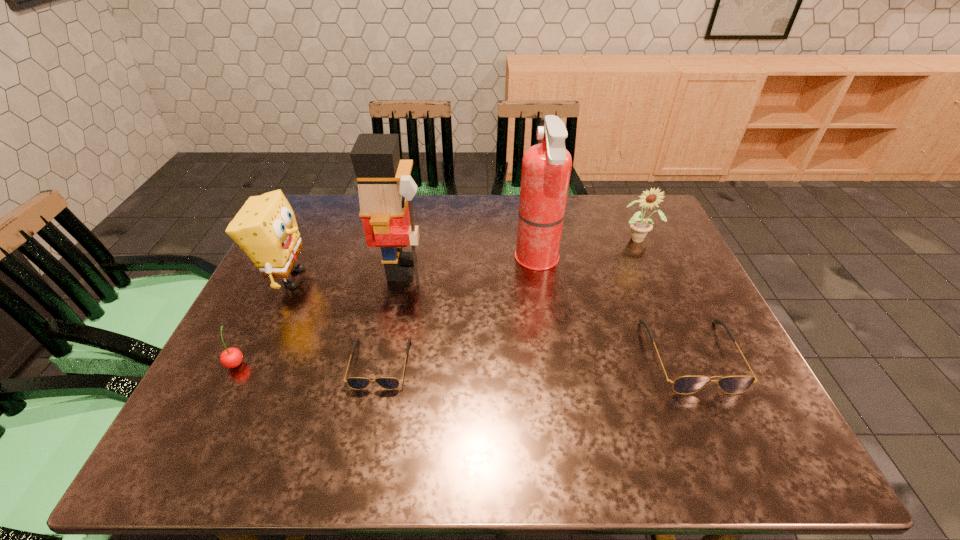
Image resolution: width=960 pixels, height=540 pixels. Identify the location of sunglasses positioned at the right edge. (690, 384).

Locate an element on the screen. The width and height of the screenshot is (960, 540). sunflower at the right edge is located at coordinates (640, 227).

Find the location of a particular element. Image resolution: width=960 pixels, height=540 pixels. object that is at the far right corner is located at coordinates (640, 227).

This screenshot has height=540, width=960. Identify the location of object located at the near right corner. [x=690, y=384].

You are a GUI agent. You are given a task and a screenshot of the screen. Output one action in this format:
    pyautogui.click(x=<x>, y=<y>)
    Task: Click on the free space at the far edge of the desktop
    
    Given the screenshot: What is the action you would take?
    pyautogui.click(x=564, y=236)

In the image, there is a desktop. At what (x,y) coordinates should I click in order to perform the action: click on free space at the near edge. Please return your answer as a coordinate pair (x, y). The width and height of the screenshot is (960, 540). Looking at the image, I should click on (428, 381).

In the image, there is a desktop. Where is `free space at the left edge`? This screenshot has width=960, height=540. free space at the left edge is located at coordinates (307, 267).

Where is `vacant area at the right edge of the desktop`? vacant area at the right edge of the desktop is located at coordinates (664, 303).

Locate an element on the screen. Image resolution: width=960 pixels, height=540 pixels. free region at the far left corner of the desktop is located at coordinates (334, 198).

Locate an element on the screen. This screenshot has height=540, width=960. vacant point at the near left corner is located at coordinates (264, 408).